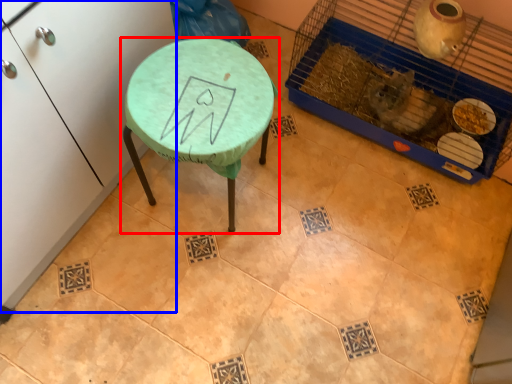
Question: Which object is closer to the camera taking this photo, table (highlighted by a red box) or furniture (highlighted by a blue box)?

Choices:
 (A) table
 (B) furniture

Answer: (B)